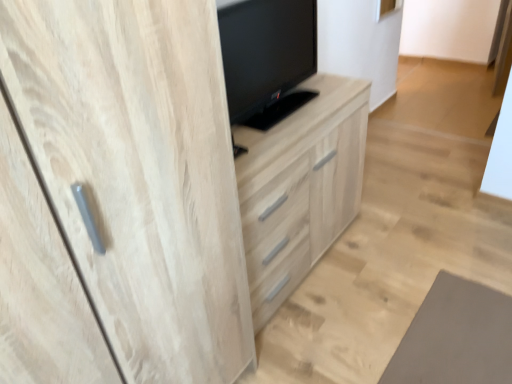
Question: Would you say black glossy tv at center is to the left or to the right of light wood cabinet at center in the picture?

Choices:
 (A) right
 (B) left

Answer: (B)

Question: From a real-world perspective, is black glossy tv at center physically located above or below light wood cabinet at center?

Choices:
 (A) above
 (B) below

Answer: (A)

Question: In terms of width, does black glossy tv at center look wider or thinner when compared to light wood cabinet at center?

Choices:
 (A) thin
 (B) wide

Answer: (A)

Question: Considering the positions of light wood cabinet at center and black glossy tv at center in the image, is light wood cabinet at center wider or thinner than black glossy tv at center?

Choices:
 (A) wide
 (B) thin

Answer: (A)

Question: Considering the positions of light wood cabinet at center and black glossy tv at center in the image, is light wood cabinet at center taller or shorter than black glossy tv at center?

Choices:
 (A) short
 (B) tall

Answer: (B)

Question: Would you say light wood cabinet at center is to the left or to the right of black glossy tv at center in the picture?

Choices:
 (A) right
 (B) left

Answer: (A)

Question: In terms of size, does light wood cabinet at center appear bigger or smaller than black glossy tv at center?

Choices:
 (A) big
 (B) small

Answer: (A)